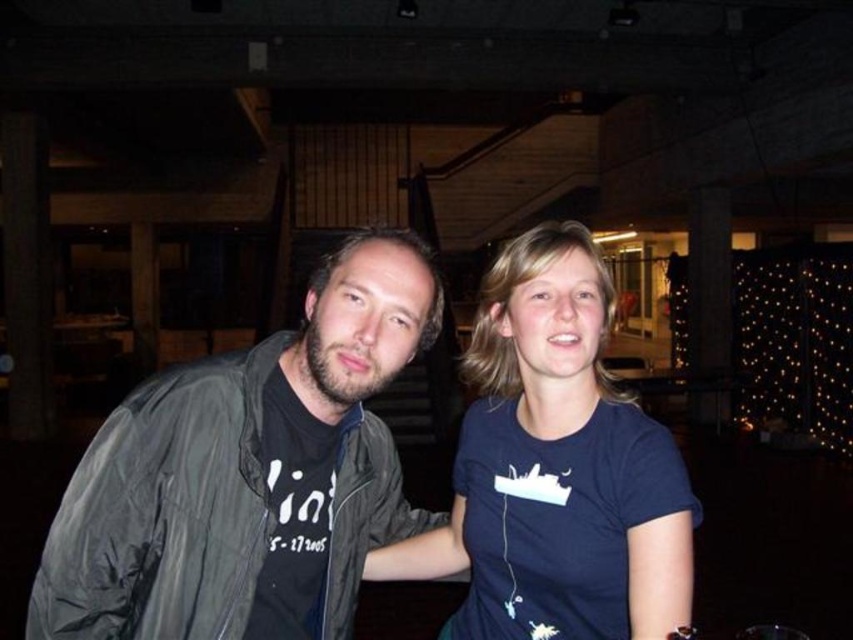
Who is more forward, (410,276) or (582,307)?

Point (410,276)

Which is below, dark gray jacket at center or dark blue t-shirt at center?

dark gray jacket at center is below.

Which is behind, point (306, 362) or point (576, 467)?

The point (576, 467) is behind.

Identify the location of dark gray jacket at center. Image resolution: width=853 pixels, height=640 pixels. (248, 474).